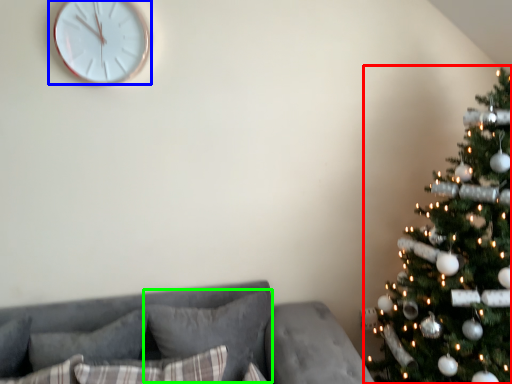
Question: Which is farther away from christmas tree (highlighted by a red box)? wall clock (highlighted by a blue box) or pillow (highlighted by a green box)?

Choices:
 (A) wall clock
 (B) pillow

Answer: (A)